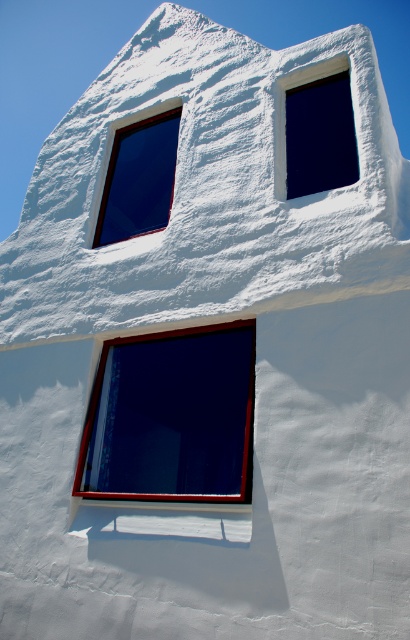
Does matte black window at center lie behind matte glass window at upper left?

No, matte black window at center is closer to the viewer.

Between point (152, 429) and point (164, 216), which one is positioned in front?

Point (164, 216)

You are a GUI agent. You are given a task and a screenshot of the screen. Output one action in this format:
    pyautogui.click(x=<x>, y=<y>)
    Task: Click on the matte black window at center
    This screenshot has width=410, height=640.
    Given the screenshot: What is the action you would take?
    pyautogui.click(x=172, y=417)

At what (x,y) coordinates should I click in order to perform the action: click on matte black window at center. Please return your answer as a coordinate pair (x, y). The width and height of the screenshot is (410, 640). Looking at the image, I should click on (172, 417).

Is point (186, 486) closer to viewer compared to point (286, 104)?

No, it is not.

Between matte black window at center and matte glass window at upper right, which one has less height?

With less height is matte glass window at upper right.

Image resolution: width=410 pixels, height=640 pixels. I want to click on matte black window at center, so click(x=172, y=417).

Find the location of `matte black window at center`. matte black window at center is located at coordinates (172, 417).

Which is below, matte glass window at upper right or matte glass window at upper left?

matte glass window at upper left

Find the location of a particular element. The image size is (410, 640). matte glass window at upper right is located at coordinates (314, 129).

Where is `matte glass window at upper right`? The height and width of the screenshot is (640, 410). matte glass window at upper right is located at coordinates (314, 129).